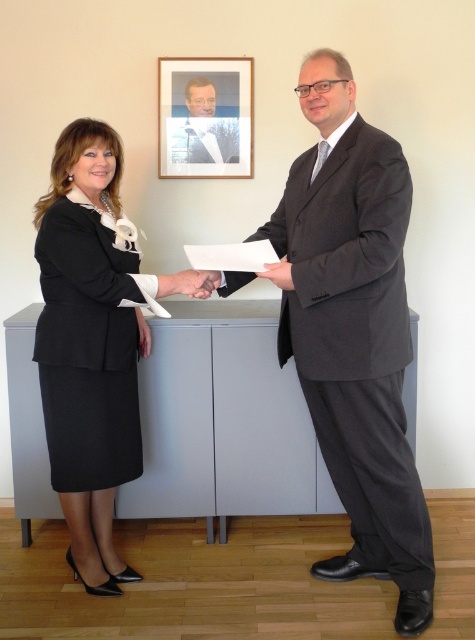
Question: In this image, where is dark gray suit at right located relative to matte black suit at center?

Choices:
 (A) right
 (B) left

Answer: (A)

Question: Among these points, which one is nearest to the camera?

Choices:
 (A) (83, 474)
 (B) (53, 221)

Answer: (B)

Question: Can you confirm if dark gray suit at right is bigger than black woolen skirt at left?

Choices:
 (A) no
 (B) yes

Answer: (B)

Question: Estimate the real-world distances between objects in this image. Which object is farther from the dark gray suit at right?

Choices:
 (A) wooden picture frame at upper center
 (B) matte black suit at left
 (C) black woolen skirt at left

Answer: (A)

Question: Is wooden picture frame at upper center wider than matte black suit at center?

Choices:
 (A) yes
 (B) no

Answer: (A)

Question: Which is farther from the matte black suit at center?

Choices:
 (A) black woolen skirt at left
 (B) wooden picture frame at upper center
 (C) matte black suit at left
 (D) dark gray suit at right

Answer: (A)